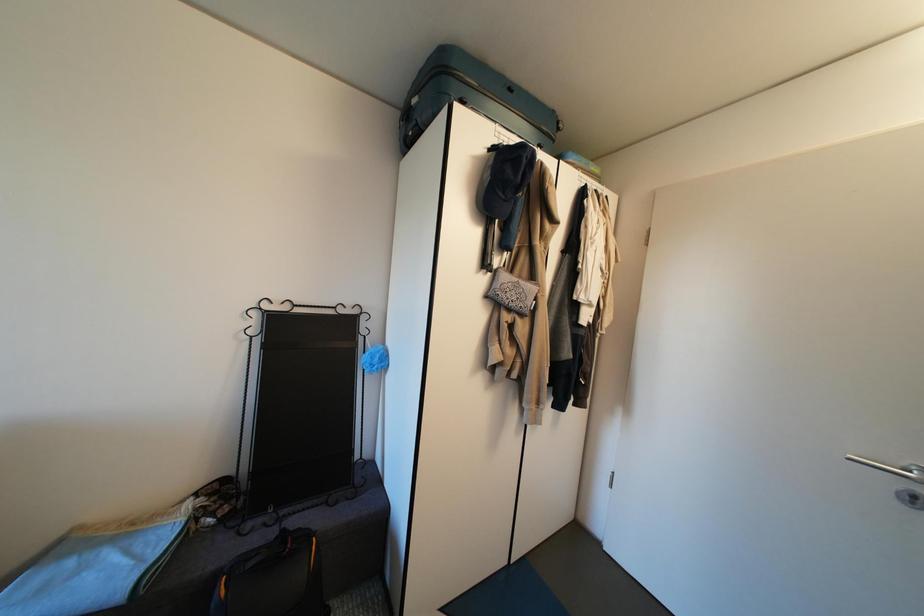
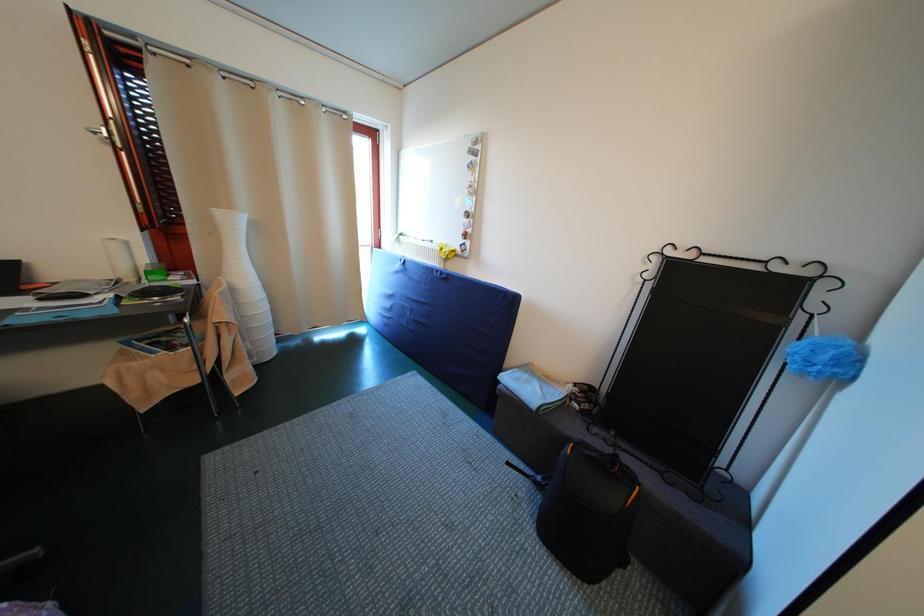
Question: The first image is from the beginning of the video and the second image is from the end. How did the camera likely rotate when shooting the video?

Choices:
 (A) Left
 (B) Right
 (C) Up
 (D) Down

Answer: (A)